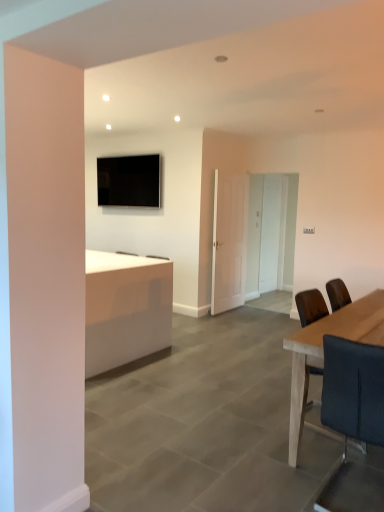
At what (x,y) coordinates should I click in order to perform the action: click on white glossy desk at center. Please return your answer as a coordinate pair (x, y). This screenshot has height=512, width=384. Looking at the image, I should click on (125, 309).

Identify the location of matte black tv at upper center. (129, 181).

What do you see at coordinates (273, 232) in the screenshot? This screenshot has height=512, width=384. I see `transparent glass door at center` at bounding box center [273, 232].

The height and width of the screenshot is (512, 384). Find the location of `white matte door at center`. white matte door at center is located at coordinates (229, 241).

In order to click on black leather chair at right in this screenshot , I will do `click(353, 421)`.

Is light brown wooden table at right at the right side of matte black tv at upper center?

Indeed, light brown wooden table at right is positioned on the right side of matte black tv at upper center.

Which is behind, point (349, 324) or point (132, 187)?

Positioned behind is point (132, 187).

Is light brown wooden table at right looking in the opposite direction of matte black tv at upper center?

No, light brown wooden table at right is not facing the opposite direction of matte black tv at upper center.

Is light brown wooden table at right touching matte black tv at upper center?

No, light brown wooden table at right is not making contact with matte black tv at upper center.

From the image's perspective, between light brown wooden table at right and transparent glass door at center, who is located below?

light brown wooden table at right.

Is light brown wooden table at right positioned beyond the bounds of transparent glass door at center?

light brown wooden table at right lies outside transparent glass door at center's area.

From a real-world perspective, does light brown wooden table at right stand above transparent glass door at center?

Actually, light brown wooden table at right is physically below transparent glass door at center in the real world.

Which point is more forward, (292, 440) or (282, 217)?

Positioned in front is point (292, 440).

Who is shorter, matte black tv at upper center or transparent glass door at center?

With less height is matte black tv at upper center.

Does matte black tv at upper center turn towards transparent glass door at center?

No, matte black tv at upper center does not turn towards transparent glass door at center.

The height and width of the screenshot is (512, 384). I want to click on television in front of the transparent glass door at center, so click(x=129, y=181).

Who is bigger, black leather chair at right or matte black tv at upper center?

black leather chair at right is bigger.

From the image's perspective, is black leather chair at right located above or below matte black tv at upper center?

black leather chair at right is below matte black tv at upper center.

From a real-world perspective, is black leather chair at right over matte black tv at upper center?

No, from a real-world perspective, black leather chair at right is not on top of matte black tv at upper center.

Which object is thinner, black leather chair at right or matte black tv at upper center?

With smaller width is matte black tv at upper center.

Is point (145, 347) positioned after point (329, 375)?

Yes, it is.

Is white glossy desk at center placed right next to black leather chair at right?

No, white glossy desk at center is not making contact with black leather chair at right.

Is white glossy desk at center positioned beyond the bounds of black leather chair at right?

Yes, white glossy desk at center is outside of black leather chair at right.

Does white glossy desk at center have a larger size compared to black leather chair at right?

Yes.

Considering the relative sizes of matte black tv at upper center and light brown wooden table at right in the image provided, is matte black tv at upper center taller than light brown wooden table at right?

No.

From the image's perspective, which one is positioned higher, matte black tv at upper center or light brown wooden table at right?

matte black tv at upper center appears higher in the image.

Is matte black tv at upper center inside the boundaries of light brown wooden table at right, or outside?

matte black tv at upper center is located beyond the bounds of light brown wooden table at right.

At what (x,y) coordinates should I click in order to perform the action: click on desk behind the light brown wooden table at right. Please return your answer as a coordinate pair (x, y). Image resolution: width=384 pixels, height=512 pixels. Looking at the image, I should click on (125, 309).

Considering the sizes of objects white glossy desk at center and light brown wooden table at right in the image provided, who is shorter, white glossy desk at center or light brown wooden table at right?

With less height is light brown wooden table at right.

Which is in front, point (90, 355) or point (290, 451)?

Point (290, 451)

What's the angular difference between white glossy desk at center and light brown wooden table at right's facing directions?

0.633 degrees.

In the image, there is a matte black tv at upper center. Identify the location of table below it (from a real-world perspective). The image size is (384, 512). (323, 353).

Find the location of a particular element. This screenshot has width=384, height=512. glass door on the right of light brown wooden table at right is located at coordinates (273, 232).

From the image, which object appears to be farther from transparent glass door at center, matte black tv at upper center or white matte door at center?

Among the two, matte black tv at upper center is located further to transparent glass door at center.

From the image, which object appears to be farther from black leather chair at right, transparent glass door at center or white matte door at center?

Among the two, transparent glass door at center is located further to black leather chair at right.

When comparing their distances from black leather chair at right, does matte black tv at upper center or white matte door at center seem further?

matte black tv at upper center.

Which object lies nearer to the anchor point black leather chair at right, transparent glass door at center or matte black tv at upper center?

matte black tv at upper center is positioned closer to the anchor black leather chair at right.

From the image, which object appears to be nearer to light brown wooden table at right, white glossy desk at center or transparent glass door at center?

The object closer to light brown wooden table at right is white glossy desk at center.

Based on their spatial positions, is white matte door at center or matte black tv at upper center closer to black leather chair at right?

Among the two, white matte door at center is located nearer to black leather chair at right.

Considering their positions, is transparent glass door at center positioned closer to white glossy desk at center than light brown wooden table at right?

Among the two, light brown wooden table at right is located nearer to white glossy desk at center.

From the picture: Looking at the image, which one is located further to light brown wooden table at right, black leather chair at right or matte black tv at upper center?

Among the two, matte black tv at upper center is located further to light brown wooden table at right.

What are the coordinates of `desk between light brown wooden table at right and transparent glass door at center along the z-axis` in the screenshot? It's located at (125, 309).

Image resolution: width=384 pixels, height=512 pixels. In order to click on desk between black leather chair at right and white matte door at center from front to back in this screenshot , I will do tap(125, 309).

At what (x,y) coordinates should I click in order to perform the action: click on television located between black leather chair at right and transparent glass door at center in the depth direction. Please return your answer as a coordinate pair (x, y). This screenshot has height=512, width=384. Looking at the image, I should click on (129, 181).

Identify the location of door between light brown wooden table at right and matte black tv at upper center in the front-back direction. (229, 241).